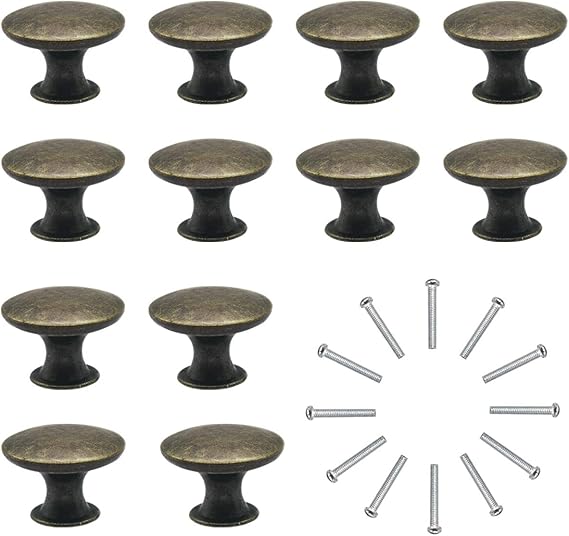
Identify the location of four knobs on second row from the top. This screenshot has height=536, width=569. (506, 186), (362, 183), (229, 174), (89, 172).